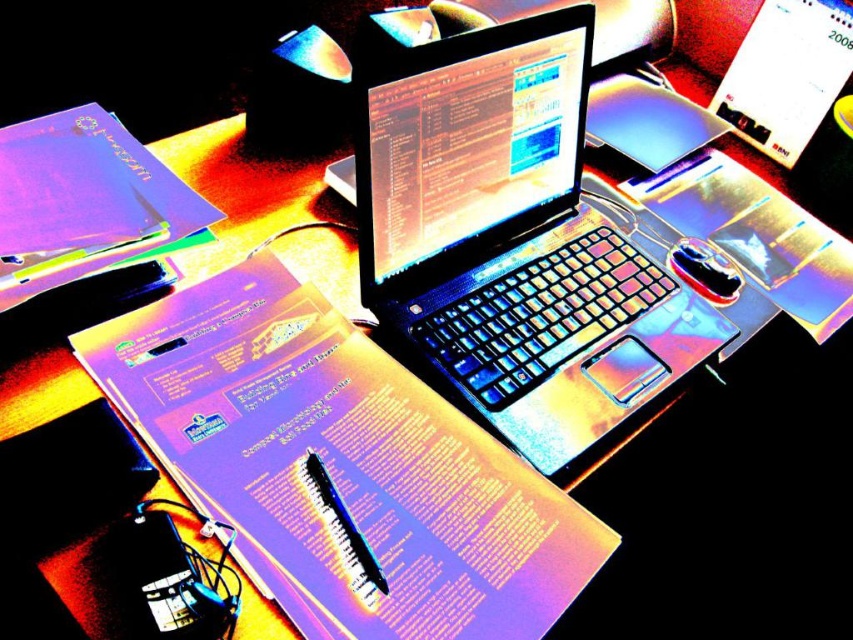
You are organizing a workspace and need to place a new notebook. The current setup has a laptop at the center and a point marked at coordinates (x=340, y=467) which indicates matte paper at center. Where should you place the new notebook to avoid covering the laptop or the matte paper?

The point marked at coordinates (x=340, y=467) indicates matte paper at center, so place the new notebook away from the laptop at the center and the matte paper at center to avoid covering them.

Based on the photo, you are organizing your desk and want to place both the satin black laptop at center and the metallic glossy mouse at center into a storage box. The box has a maximum capacity of 12 liters. If the laptop occupies 8 liters and the mouse takes up 2 liters, will both items fit inside the box?

The satin black laptop at center occupies 8 liters and the metallic glossy mouse at center takes up 2 liters, totaling 10 liters. Since the box can hold up to 12 liters, both items will fit inside the box.

You are a delivery robot standing 20 inches away from the workspace. You need to place a matte paper at center on the desk. Can you reach it?

The matte paper at center is 19.73 inches away from viewer, so yes, the delivery robot can reach it since it is within the 20 inches distance.